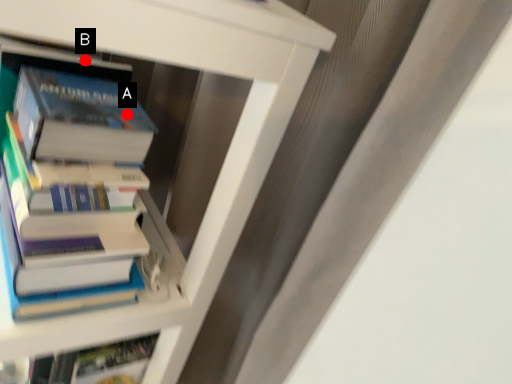
Question: Two points are circled on the image, labeled by A and B beside each circle. Which point is closer to the camera taking this photo?

Choices:
 (A) A is closer
 (B) B is closer

Answer: (A)